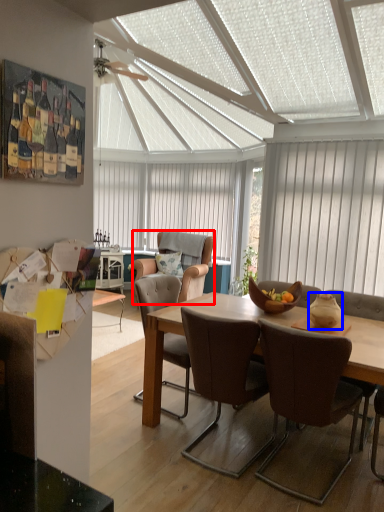
Question: Which of the following is the closest to the observer, chair (highlighted by a red box) or vase (highlighted by a blue box)?

Choices:
 (A) chair
 (B) vase

Answer: (B)